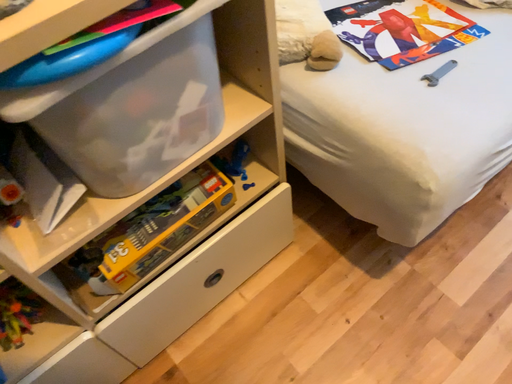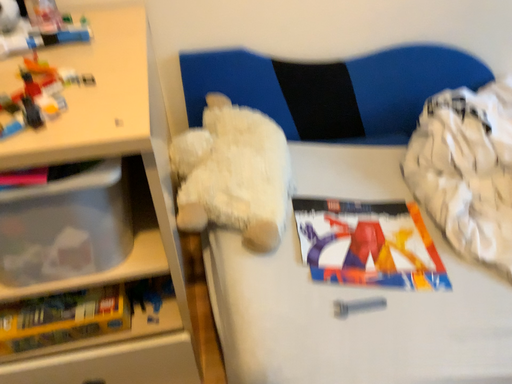
Question: How did the camera likely rotate when shooting the video?

Choices:
 (A) rotated downward
 (B) rotated upward

Answer: (B)